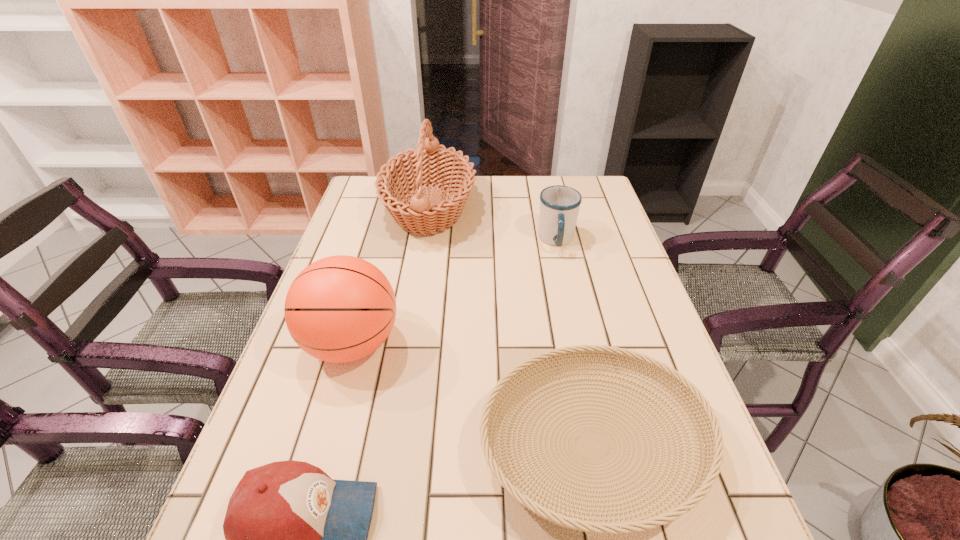
Image resolution: width=960 pixels, height=540 pixels. Find the location of `the left basket`. the left basket is located at coordinates (410, 171).

Find the location of `the farther basket`. the farther basket is located at coordinates (410, 171).

The image size is (960, 540). I want to click on basketball, so click(339, 309).

Find the location of a particular element. The height and width of the screenshot is (540, 960). mug is located at coordinates (559, 205).

Where is `vacant region located 0.170m on the right of the taller basket`? The image size is (960, 540). vacant region located 0.170m on the right of the taller basket is located at coordinates (529, 209).

Where is `blank space located on the back of the fourth shortest object`? This screenshot has width=960, height=540. blank space located on the back of the fourth shortest object is located at coordinates (375, 260).

This screenshot has height=540, width=960. I want to click on vacant space located 0.200m on the handle side of the third tallest object, so click(x=571, y=308).

This screenshot has width=960, height=540. What are the coordinates of `object located at the far edge` in the screenshot? It's located at (410, 171).

Identify the location of basket positioned at the left edge. (410, 171).

Where is `basketball that is at the left edge`? This screenshot has width=960, height=540. basketball that is at the left edge is located at coordinates (339, 309).